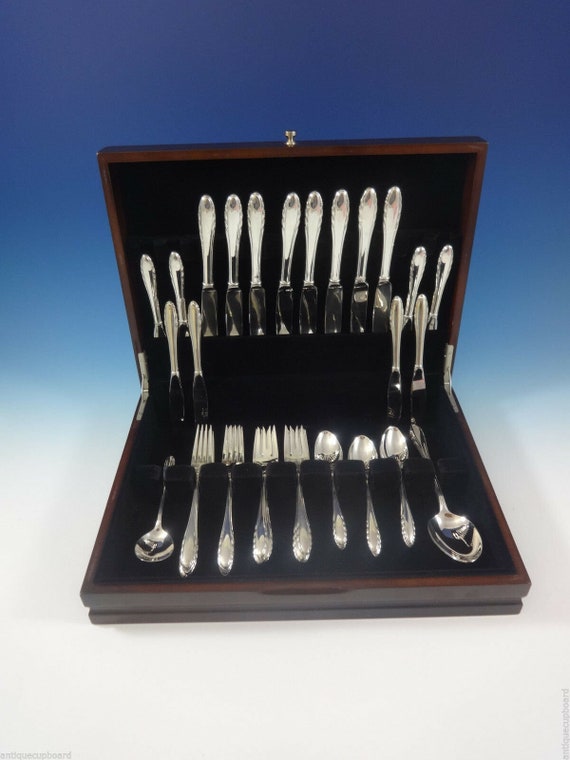
This screenshot has height=760, width=570. Find the location of `spoons`. spoons is located at coordinates (331, 442), (358, 437), (388, 442), (445, 530), (148, 556).